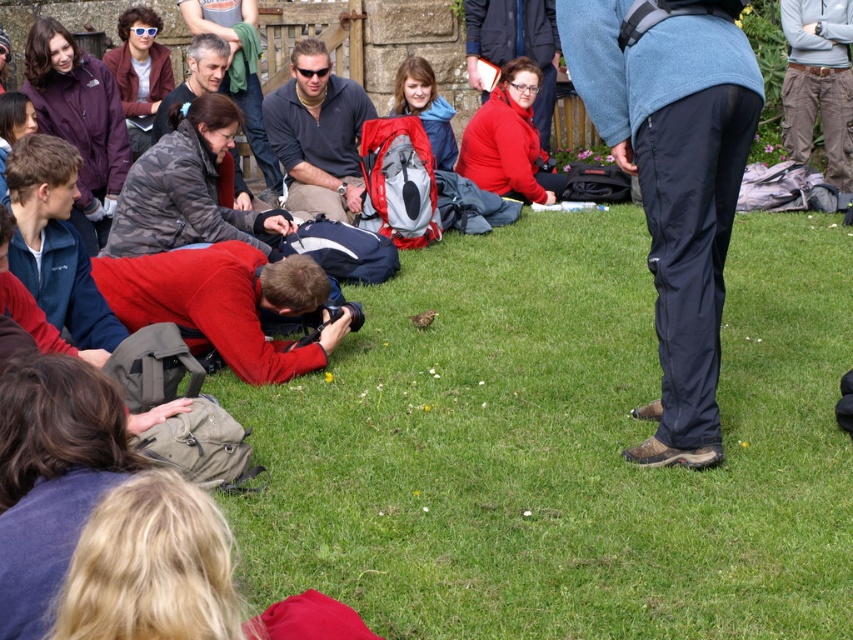
Question: Is green grass at center positioned before sunglassesmaterial at center?

Choices:
 (A) yes
 (B) no

Answer: (A)

Question: Which point is closer to the camera taking this photo?

Choices:
 (A) (312, 48)
 (B) (648, 316)

Answer: (B)

Question: Among these objects, which one is nearest to the camera?

Choices:
 (A) matte red jacket at center
 (B) sunglassesmaterial at center
 (C) green grass at center

Answer: (C)

Question: Which point appears closest to the camera in this image?

Choices:
 (A) (759, 349)
 (B) (537, 20)

Answer: (A)

Question: Is green grass at center bigger than matte red jacket at center?

Choices:
 (A) yes
 (B) no

Answer: (A)

Question: Does sunglassesmaterial at center have a larger size compared to matte red jacket at center?

Choices:
 (A) yes
 (B) no

Answer: (A)